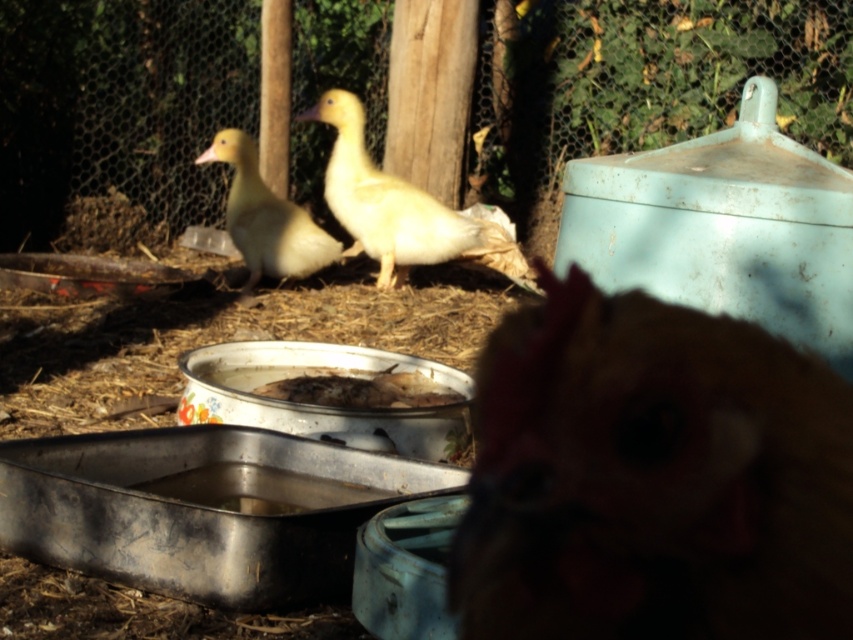
You are standing in the farmyard and see the brown feathered chicken at center and the yellow downy duckling at center. Which animal is positioned to the right of the other?

The brown feathered chicken at center is positioned to the right of the yellow downy duckling at center.

You are a farmer who wants to place both the brown feathered chicken at center and the white matte duck at center into a rectangular pen. The pen can only accommodate one of them at a time. Which animal would require a wider pen based on their size?

The white matte duck at center requires a wider pen because it has a greater width than the brown feathered chicken at center.

You are a farmer checking the health of your poultry. You notice the brown feathered chicken at center and the yellow downy duckling at center. Which one has a shorter height?

The brown feathered chicken at center is shorter than the yellow downy duckling at center.